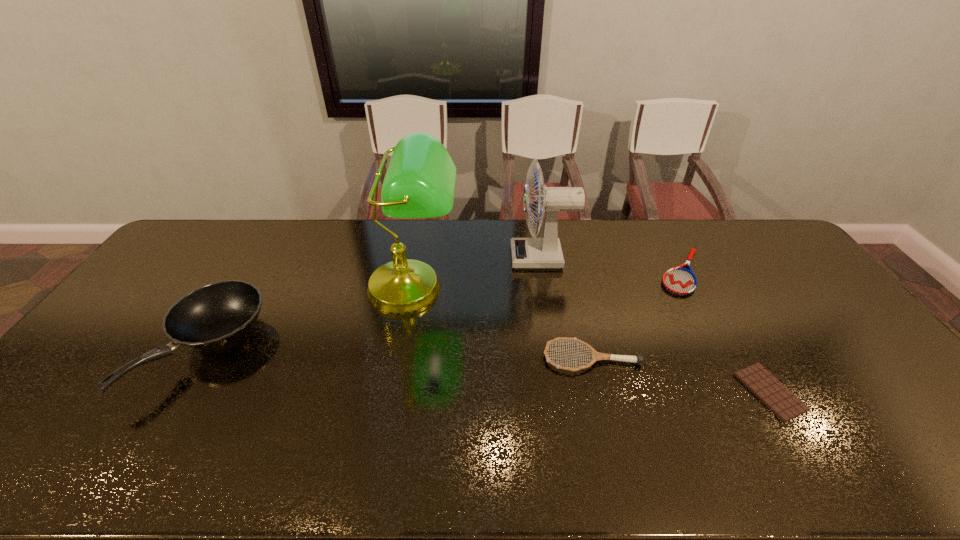
Find the location of a particular element. vacant area that lies between the frying pan and the fifth object from right to left is located at coordinates (310, 319).

You are a GUI agent. You are given a task and a screenshot of the screen. Output one action in this format:
    pyautogui.click(x=<x>, y=<y>)
    Task: Click on the vacant region between the nearer tennis racket and the frying pan
    
    Given the screenshot: What is the action you would take?
    pyautogui.click(x=399, y=354)

This screenshot has width=960, height=540. Find the location of `free space between the third tallest object and the chocolate bar`. free space between the third tallest object and the chocolate bar is located at coordinates (489, 371).

Image resolution: width=960 pixels, height=540 pixels. Identify the location of free space between the right tennis racket and the tallest object. (547, 280).

You are a GUI agent. You are given a task and a screenshot of the screen. Output one action in this format:
    pyautogui.click(x=<x>, y=<y>)
    Task: Click on the free space between the shorter tennis racket and the lamp
    
    Given the screenshot: What is the action you would take?
    pyautogui.click(x=547, y=280)

Find the location of `vacant space that is in between the shortest object and the shorter tennis racket`. vacant space that is in between the shortest object and the shorter tennis racket is located at coordinates (726, 332).

The height and width of the screenshot is (540, 960). I want to click on the closest object relative to the chocolate bar, so click(596, 356).

Image resolution: width=960 pixels, height=540 pixels. In order to click on the closest object to the fifth object from right to left in this screenshot , I will do `click(527, 253)`.

You are a GUI agent. You are given a task and a screenshot of the screen. Output one action in this format:
    pyautogui.click(x=<x>, y=<y>)
    Task: Click on the blank area in the image that satisfies the following two spatial constraints: 1. on the desk next to the tallest object; 2. on the right side of the third shortest object
    This screenshot has height=540, width=960.
    Given the screenshot: What is the action you would take?
    pyautogui.click(x=401, y=357)

Locate an element on the screen. Image resolution: width=960 pixels, height=540 pixels. free spot that satisfies the following two spatial constraints: 1. on the desk next to the second object from left to right; 2. on the right side of the chocolate bar is located at coordinates (396, 392).